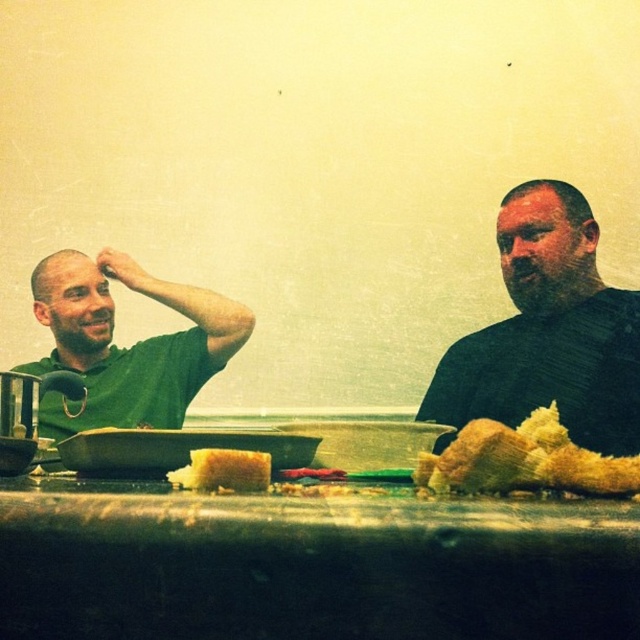
You are a customer at a restaurant and want to place your napkin on the shiny metallic table at center. However, there is a dark green sweater at right on the table. Can you place your napkin there without moving the sweater?

The shiny metallic table at center is positioned under the dark green sweater at right, meaning the sweater is on top of the table. Therefore, you can place your napkin on the table next to the sweater without moving it.

You are standing behind the table and want to reach the yellow crumbly bread at center without moving the dark green sweater at right. Is this possible?

The dark green sweater at right is further to the viewer than the yellow crumbly bread at center, so the bread is closer to you. You can reach the yellow crumbly bread at center without moving the dark green sweater at right because it is in front of the sweater.

You are standing in front of the table and want to place a small object on the table. You have two points to choose from. Which point is closer to you, point (x=243, y=538) or point (x=557, y=436)?

Point (x=243, y=538) is closer to the viewer than point (x=557, y=436), so you should place the object there.